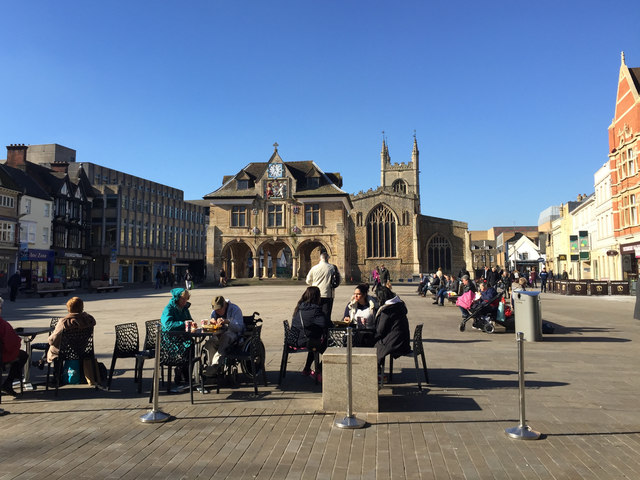
Where is `clock`? clock is located at coordinates (276, 170).